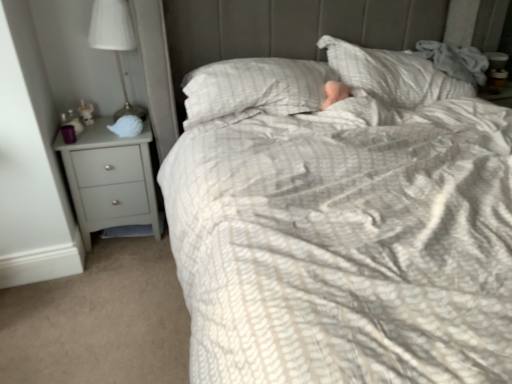
Describe the element at coordinates (110, 179) in the screenshot. The image size is (512, 384). I see `matte gray chest of drawers at left` at that location.

This screenshot has width=512, height=384. Identify the location of white matte shell at left. (127, 126).

Looking at this image, from their relative heights in the image, would you say white matte shell at left is taller or shorter than white fabric lampshade at left?

Considering their sizes, white matte shell at left has less height than white fabric lampshade at left.

How many degrees apart are the facing directions of white matte shell at left and white fabric lampshade at left?

The angular difference between white matte shell at left and white fabric lampshade at left is 5.28 degrees.

Considering the positions of objects white matte shell at left and white fabric lampshade at left in the image provided, who is more to the right, white matte shell at left or white fabric lampshade at left?

white matte shell at left.

Does white matte shell at left touch white fabric lampshade at left?

No, white matte shell at left is not making contact with white fabric lampshade at left.

Consider the image. Is matte gray chest of drawers at left placed right next to white fabric lampshade at left?

No, matte gray chest of drawers at left is not touching white fabric lampshade at left.

I want to click on lamp to the right of matte gray chest of drawers at left, so click(114, 41).

Considering the relative positions of matte gray chest of drawers at left and white fabric lampshade at left in the image provided, is matte gray chest of drawers at left to the left or to the right of white fabric lampshade at left?

In the image, matte gray chest of drawers at left appears on the left side of white fabric lampshade at left.

Which is nearer, (136, 205) or (124, 5)?

Point (136, 205) appears to be farther away from the viewer than point (124, 5).

Which of these two, white fabric lampshade at left or matte gray chest of drawers at left, is thinner?

Thinner between the two is white fabric lampshade at left.

Considering the sizes of white fabric lampshade at left and matte gray chest of drawers at left in the image, is white fabric lampshade at left bigger or smaller than matte gray chest of drawers at left?

Clearly, white fabric lampshade at left is smaller in size than matte gray chest of drawers at left.

Is white fabric lampshade at left not within matte gray chest of drawers at left?

Yes, white fabric lampshade at left is located beyond the bounds of matte gray chest of drawers at left.

Consider the image. Considering the relative sizes of white fabric lampshade at left and matte gray chest of drawers at left in the image provided, is white fabric lampshade at left shorter than matte gray chest of drawers at left?

Correct, white fabric lampshade at left is not as tall as matte gray chest of drawers at left.

Find the location of a particular element. Image resolution: width=512 pixels, height=384 pixels. chest of drawers on the left of the white matte shell at left is located at coordinates (110, 179).

Is white matte shell at left facing away from matte gray chest of drawers at left?

white matte shell at left does not have its back to matte gray chest of drawers at left.

Is matte gray chest of drawers at left surrounded by white matte shell at left?

No, matte gray chest of drawers at left is located outside of white matte shell at left.

Between matte gray chest of drawers at left and white matte shell at left, which one has smaller size?

With smaller size is white matte shell at left.

Is matte gray chest of drawers at left at the right side of white matte shell at left?

In fact, matte gray chest of drawers at left is to the left of white matte shell at left.

I want to click on sleeping bag on the right side of matte gray chest of drawers at left, so click(127, 126).

Which is in front, point (115, 10) or point (134, 127)?

Point (115, 10)

From a real-world perspective, between white fabric lampshade at left and white matte shell at left, who is vertically higher?

white fabric lampshade at left.

Looking at this image, do you think white fabric lampshade at left is within white matte shell at left, or outside of it?

white fabric lampshade at left is not enclosed by white matte shell at left.

This screenshot has width=512, height=384. What are the coordinates of `sleeping bag on the right side of white fabric lampshade at left` in the screenshot? It's located at (127, 126).

The width and height of the screenshot is (512, 384). What are the coordinates of `lamp above the matte gray chest of drawers at left (from a real-world perspective)` in the screenshot? It's located at (114, 41).

Which object lies further to the anchor point matte gray chest of drawers at left, white matte shell at left or white fabric lampshade at left?

white fabric lampshade at left.

Considering their positions, is white fabric lampshade at left positioned further to white matte shell at left than matte gray chest of drawers at left?

white fabric lampshade at left is positioned further to the anchor white matte shell at left.

From the image, which object appears to be farther from matte gray chest of drawers at left, white fabric lampshade at left or white matte shell at left?

Among the two, white fabric lampshade at left is located further to matte gray chest of drawers at left.

From the image, which object appears to be nearer to white matte shell at left, matte gray chest of drawers at left or white fabric lampshade at left?

Among the two, matte gray chest of drawers at left is located nearer to white matte shell at left.

Based on the photo, looking at the image, which one is located further to white fabric lampshade at left, white matte shell at left or matte gray chest of drawers at left?

matte gray chest of drawers at left is positioned further to the anchor white fabric lampshade at left.

Considering their positions, is matte gray chest of drawers at left positioned closer to white fabric lampshade at left than white matte shell at left?

white matte shell at left is positioned closer to the anchor white fabric lampshade at left.

I want to click on sleeping bag between white fabric lampshade at left and matte gray chest of drawers at left in the vertical direction, so click(127, 126).